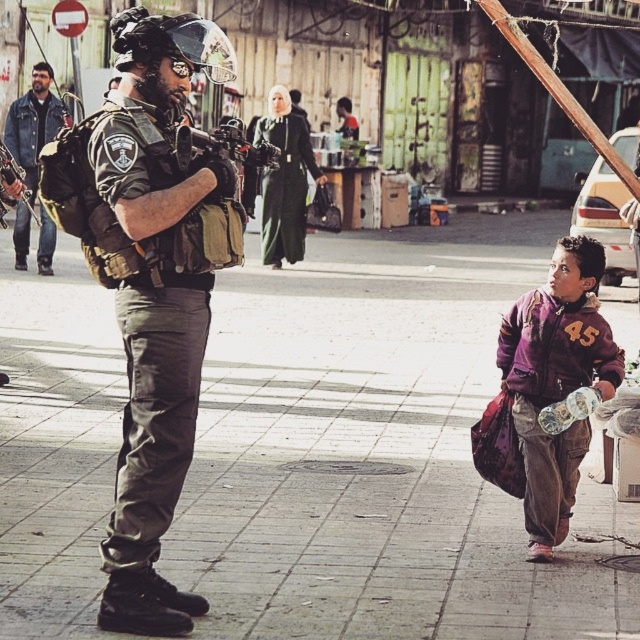
Question: Considering the real-world distances, which object is farthest from the matte black rifle at left?

Choices:
 (A) purple fleece jacket at lower right
 (B) camouflage uniform at center
 (C) denim jacket at left

Answer: (A)

Question: Which point appears farthest from the camera in this image?

Choices:
 (A) (253, 147)
 (B) (524, 424)

Answer: (A)

Question: Is camouflage uniform at center to the left of matte black rifle at left from the viewer's perspective?

Choices:
 (A) yes
 (B) no

Answer: (B)

Question: Is denim jacket at left in front of matte black rifle at center?

Choices:
 (A) yes
 (B) no

Answer: (B)

Question: Can you confirm if purple fleece jacket at lower right is thinner than denim jacket at left?

Choices:
 (A) yes
 (B) no

Answer: (A)

Question: Considering the real-world distances, which object is closest to the camouflage uniform at center?

Choices:
 (A) denim jacket at left
 (B) matte black rifle at center
 (C) purple fleece jacket at lower right

Answer: (B)